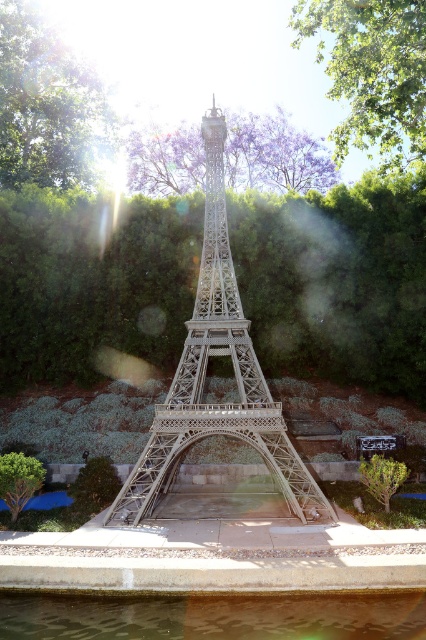
Between green leafy hedge at center and clear glass water at lower center, which one has less height?

With less height is clear glass water at lower center.

Identify the location of green leafy hedge at center. The height and width of the screenshot is (640, 426). (336, 280).

In the scene shown: Between metallic silver eiffel tower at center and clear glass water at lower center, which one appears on the left side from the viewer's perspective?

From the viewer's perspective, clear glass water at lower center appears more on the left side.

Which is above, metallic silver eiffel tower at center or clear glass water at lower center?

metallic silver eiffel tower at center

Measure the distance between point (161, 433) and camera.

Point (161, 433) is 124.07 feet away from camera.

Locate an element on the screen. This screenshot has width=426, height=640. metallic silver eiffel tower at center is located at coordinates (204, 376).

Is metallic silver eiffel tower at center below purple leafy tree at upper center?

Yes, metallic silver eiffel tower at center is below purple leafy tree at upper center.

Is point (134, 497) in front of point (135, 184)?

Yes, it is in front of point (135, 184).

I want to click on metallic silver eiffel tower at center, so click(204, 376).